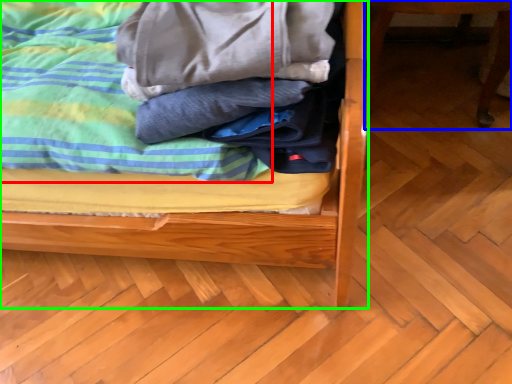
Question: Considering the real-world distances, which object is closest to blanket (highlighted by a red box)? furniture (highlighted by a blue box) or bed (highlighted by a green box).

Choices:
 (A) furniture
 (B) bed

Answer: (B)